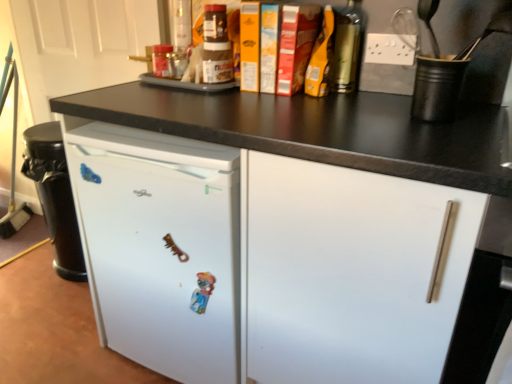
In order to click on vacant point to the right of metallic gold bottle at upper right, which is counted as the second bottle, starting from the left in this screenshot , I will do `click(373, 94)`.